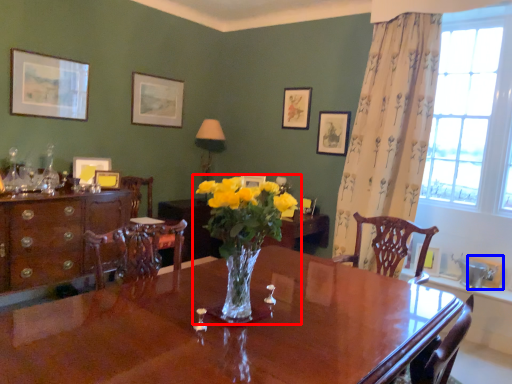
Question: Among these objects, which one is nearest to the camera, houseplant (highlighted by a red box) or picture frame (highlighted by a blue box)?

Choices:
 (A) houseplant
 (B) picture frame

Answer: (A)